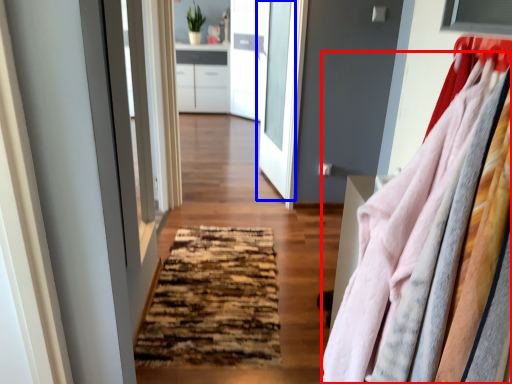
Question: Which object is closer to the camera taking this photo, clothing (highlighted by a red box) or door (highlighted by a blue box)?

Choices:
 (A) clothing
 (B) door

Answer: (A)